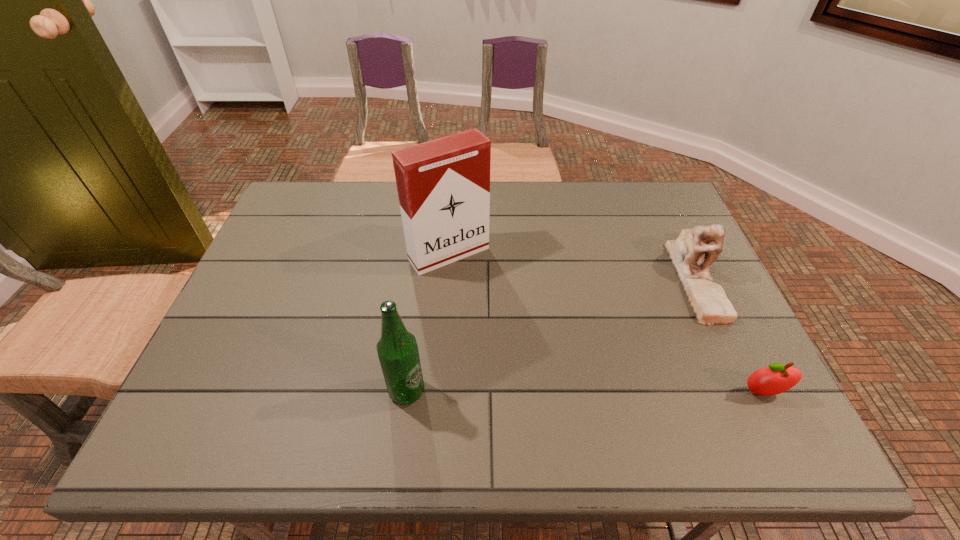
Locate an element on the screen. This screenshot has width=960, height=540. the third shortest object is located at coordinates click(x=397, y=349).

This screenshot has height=540, width=960. Identify the location of apple. (777, 378).

Locate an element on the screen. The image size is (960, 540). the third tallest object is located at coordinates (709, 302).

The height and width of the screenshot is (540, 960). I want to click on cigarette_case, so click(443, 185).

This screenshot has width=960, height=540. Identify the location of free space located on the label of the second tallest object. (608, 391).

At what (x,y) coordinates should I click in order to perform the action: click on vacant area located 0.270m on the front-facing side of the figurine. Please return your answer as a coordinate pair (x, y). The width and height of the screenshot is (960, 540). Looking at the image, I should click on (642, 380).

At what (x,y) coordinates should I click in order to perform the action: click on vacant area located 0.210m on the front-facing side of the figurine. Please return your answer as a coordinate pair (x, y). The height and width of the screenshot is (540, 960). Looking at the image, I should click on (657, 363).

Find the location of a particular element. Image resolution: width=960 pixels, height=540 pixels. vacant area situated on the front-facing side of the figurine is located at coordinates (623, 404).

Locate an element on the screen. This screenshot has height=540, width=960. free space located 0.160m on the front-facing side of the cigarette_case is located at coordinates (499, 312).

This screenshot has width=960, height=540. In order to click on vacant space located on the front-facing side of the cigarette_case in this screenshot , I will do `click(485, 294)`.